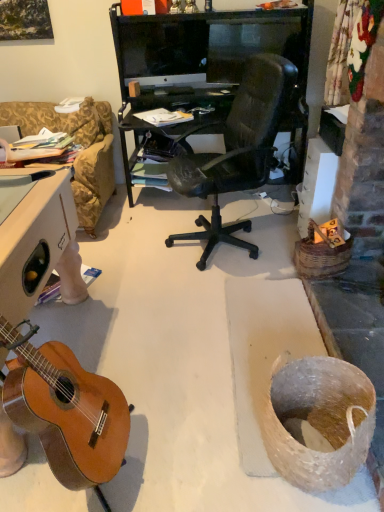
Question: Is point [x=94, y=463] closer or farther from the camera than point [x=148, y=50]?

Choices:
 (A) farther
 (B) closer

Answer: (B)

Question: Looking at their shapes, would you say natural wood guitar at lower left is wider or thinner than matte black monitor at upper center?

Choices:
 (A) thin
 (B) wide

Answer: (B)

Question: From a real-world perspective, is natural wood guitar at lower left physically located above or below matte black monitor at upper center?

Choices:
 (A) below
 (B) above

Answer: (A)

Question: From a real-world perspective, is matte black monitor at upper center physically located above or below natural wood guitar at lower left?

Choices:
 (A) above
 (B) below

Answer: (A)

Question: From the image's perspective, is matte black monitor at upper center located above or below natural wood guitar at lower left?

Choices:
 (A) below
 (B) above

Answer: (B)

Question: From their relative heights in the image, would you say matte black monitor at upper center is taller or shorter than natural wood guitar at lower left?

Choices:
 (A) short
 (B) tall

Answer: (A)

Question: Is point (147, 25) positioned closer to the camera than point (46, 432)?

Choices:
 (A) closer
 (B) farther

Answer: (B)